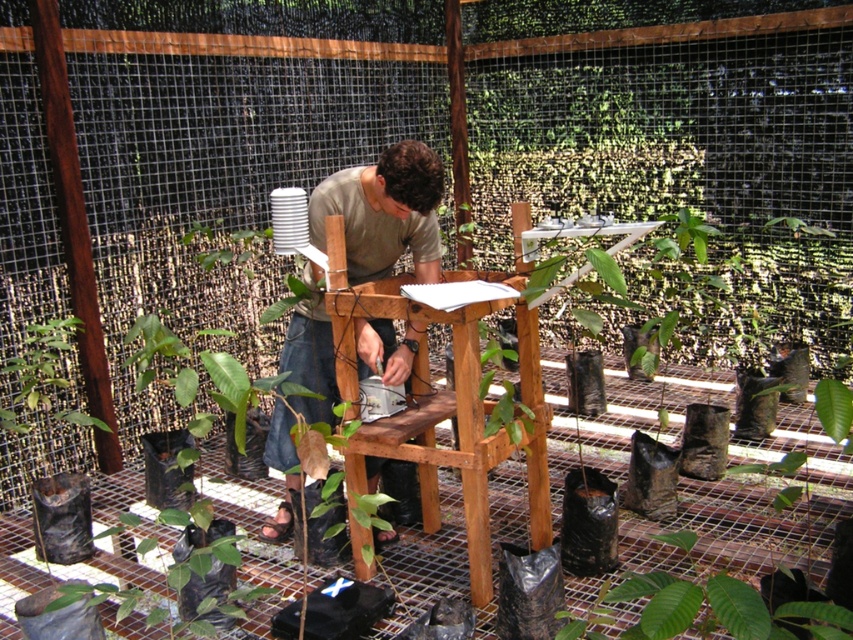
You are planning to place a new sensor on the workbench. The sensor requires a clear area of 0.5 meters in diameter. Given the current setup, can you determine if there is enough space on the workbench near the light brown wood man at center to accommodate the sensor?

The light brown wood man at center is located at point (384, 212). Without knowing the dimensions of the workbench or the exact positions of other objects, it is impossible to determine if there is enough space for the sensor.

You are an observer looking at the scene. Which object is taller between the light brown wood man at center and the green matte plant at lower right?

The light brown wood man at center is taller than the green matte plant at lower right according to the description.